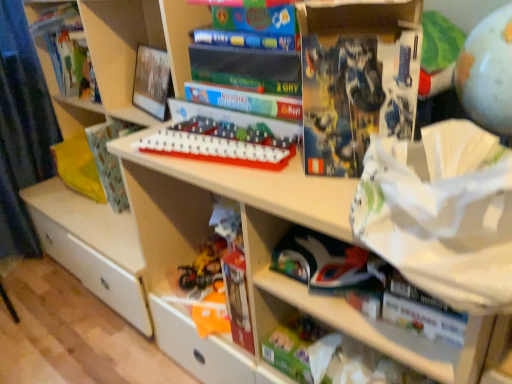
I want to click on free space in front of white plastic game board at center, the second toy in the front-to-back sequence, so click(254, 181).